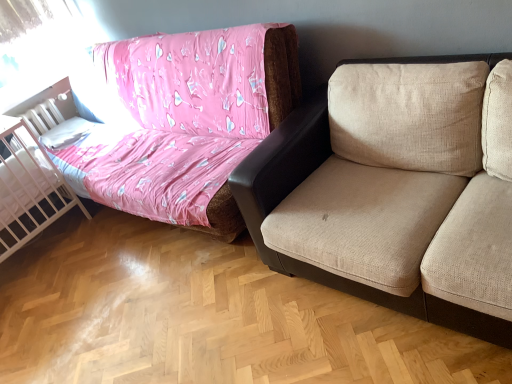
Locate an element on the screen. vacant area that is situated to the right of white mesh crib at left is located at coordinates (94, 234).